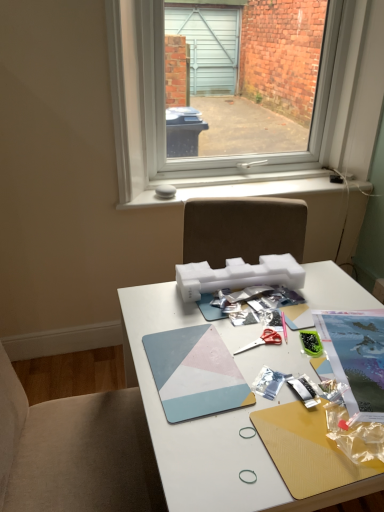
The height and width of the screenshot is (512, 384). I want to click on vacant space underneath transparent glass window at upper center (from a real-world perspective), so click(242, 180).